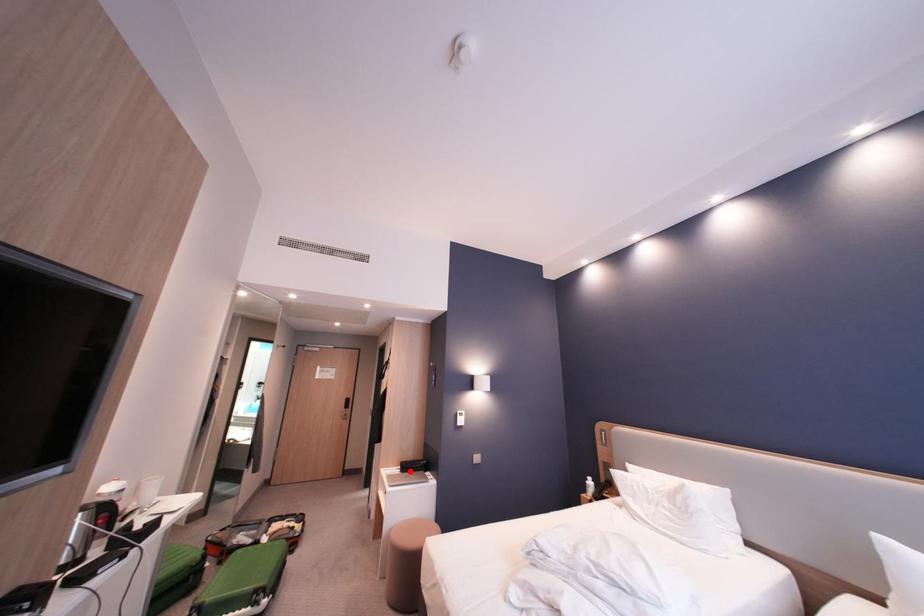
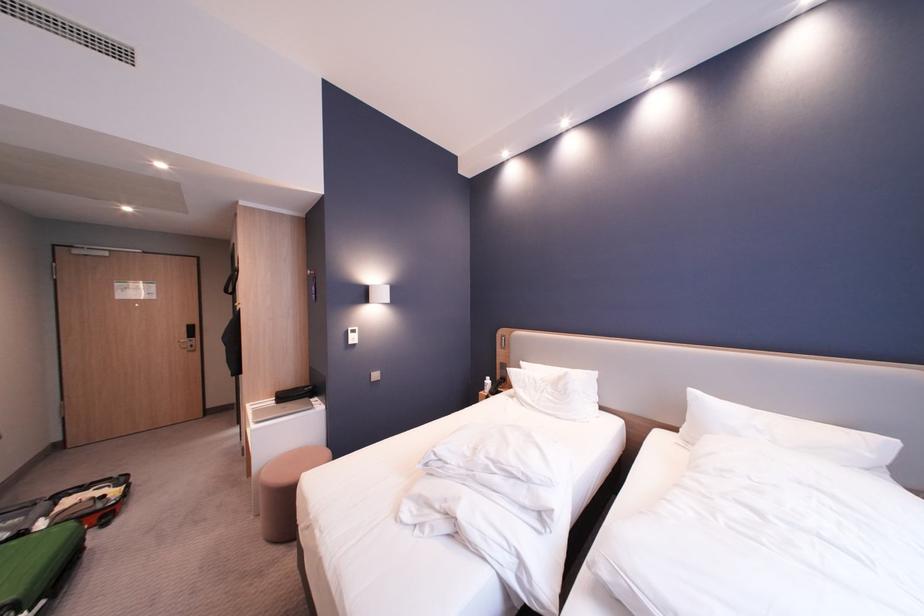
Question: A red point is marked in image1. In image2, is the corresponding 3D point closer to the camera or farther? Reply with the corresponding letter.

Choices:
 (A) The corresponding 3D point is closer.
 (B) The corresponding 3D point is farther.

Answer: (A)